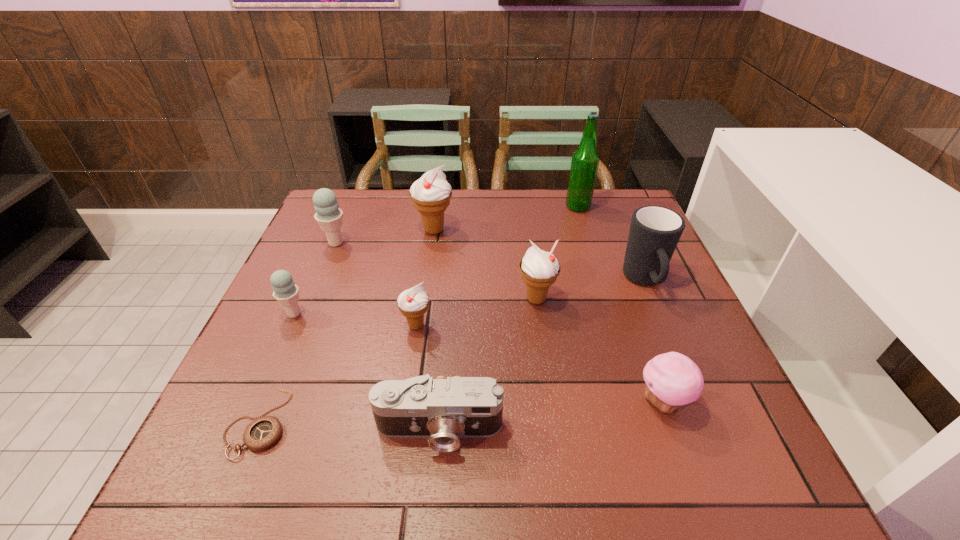
The height and width of the screenshot is (540, 960). In order to click on the farthest object in this screenshot , I will do `click(585, 160)`.

Image resolution: width=960 pixels, height=540 pixels. I want to click on green beer bottle, so click(585, 160).

This screenshot has height=540, width=960. Find the location of `the biggest white icecream`. the biggest white icecream is located at coordinates (431, 194).

Find the location of `the farthest white icecream`. the farthest white icecream is located at coordinates (431, 194).

What are the coordinates of `mug` in the screenshot? It's located at (654, 233).

This screenshot has height=540, width=960. I want to click on the bigger blue ice cream, so click(329, 216).

Find the location of a particular element. This screenshot has width=960, height=540. the second biggest white icecream is located at coordinates (539, 270).

In order to click on the rightmost white icecream in this screenshot , I will do `click(539, 270)`.

I want to click on the smaller blue ice cream, so click(x=285, y=291).

Locate an element on the screen. Image resolution: width=960 pixels, height=540 pixels. the smallest white icecream is located at coordinates (413, 303).